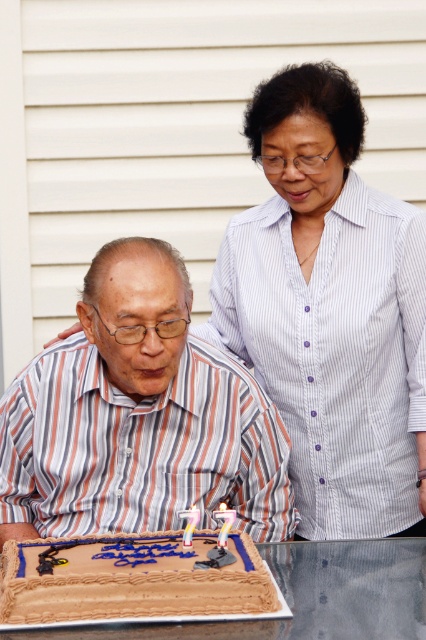
You are standing in the same area as the two people in the scene. If you want to place a gift card on the brown glossy table at lower center, which side of the white striped shirt at upper right should you approach from?

You should approach from the left side of the white striped shirt at upper right because the brown glossy table at lower center is to the left of it.